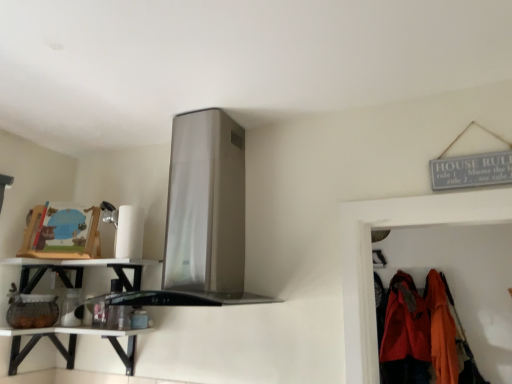
Question: Is white glossy shelf at lower left at the back of white glossy shelf at lower left?

Choices:
 (A) no
 (B) yes

Answer: (A)

Question: Is white glossy shelf at lower left a part of white glossy shelf at lower left?

Choices:
 (A) no
 (B) yes

Answer: (A)

Question: Is white glossy shelf at lower left completely or partially outside of white glossy shelf at lower left?

Choices:
 (A) yes
 (B) no

Answer: (A)

Question: Is white glossy shelf at lower left at the right side of white glossy shelf at lower left?

Choices:
 (A) no
 (B) yes

Answer: (A)

Question: From the image's perspective, is white glossy shelf at lower left above white glossy shelf at lower left?

Choices:
 (A) yes
 (B) no

Answer: (B)

Question: From the image's perspective, is white glossy shelf at lower left above or below white glossy shelf at lower left?

Choices:
 (A) above
 (B) below

Answer: (B)

Question: In terms of width, does white glossy shelf at lower left look wider or thinner when compared to white glossy shelf at lower left?

Choices:
 (A) thin
 (B) wide

Answer: (B)

Question: Is white glossy shelf at lower left inside or outside of white glossy shelf at lower left?

Choices:
 (A) outside
 (B) inside

Answer: (A)

Question: Is white glossy shelf at lower left to the left or to the right of white glossy shelf at lower left in the image?

Choices:
 (A) right
 (B) left

Answer: (B)

Question: From the image's perspective, is white glossy shelf at lower left above or below white glossy shelf at lower left?

Choices:
 (A) below
 (B) above

Answer: (B)

Question: From a real-world perspective, is white glossy shelf at lower left positioned above or below white glossy shelf at lower left?

Choices:
 (A) above
 (B) below

Answer: (A)

Question: Visually, is white glossy shelf at lower left positioned to the left or to the right of white glossy shelf at lower left?

Choices:
 (A) left
 (B) right

Answer: (B)

Question: Choose the correct answer: Is white glossy shelf at lower left inside white glossy shelf at lower left or outside it?

Choices:
 (A) inside
 (B) outside

Answer: (B)

Question: Which is correct: white glossy shelf at lower left is inside matte orange jacket at lower right, arranged as the first clothing when viewed from the left, or outside of it?

Choices:
 (A) outside
 (B) inside

Answer: (A)

Question: Is point (34, 273) closer or farther from the camera than point (425, 365)?

Choices:
 (A) farther
 (B) closer

Answer: (B)